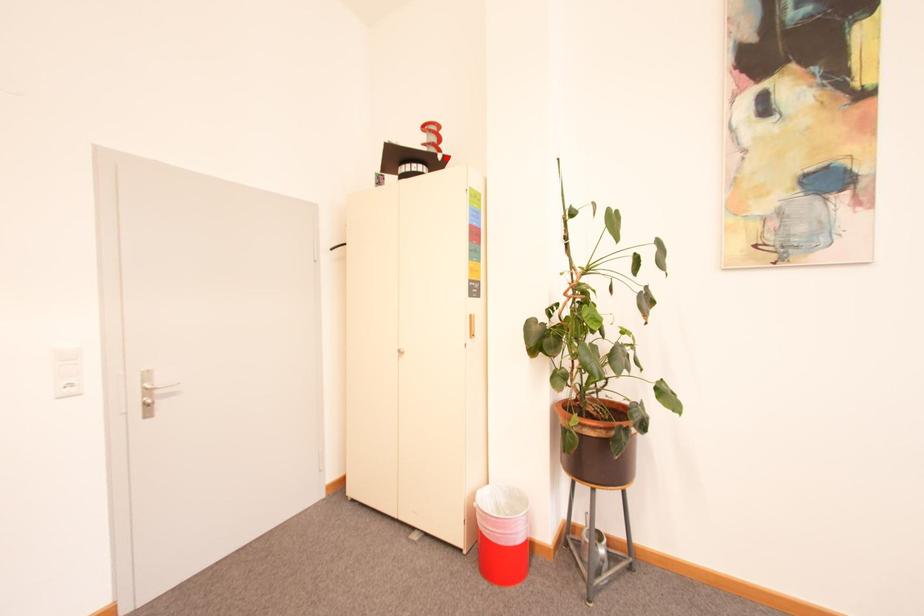
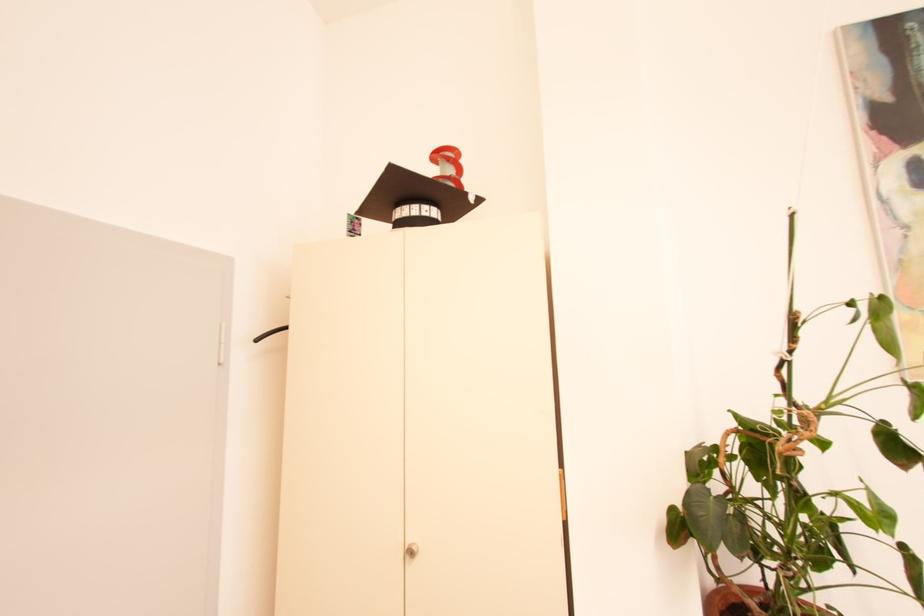
In the second image, find the point that corresponds to the highlighted location in the first image.

(478, 199)